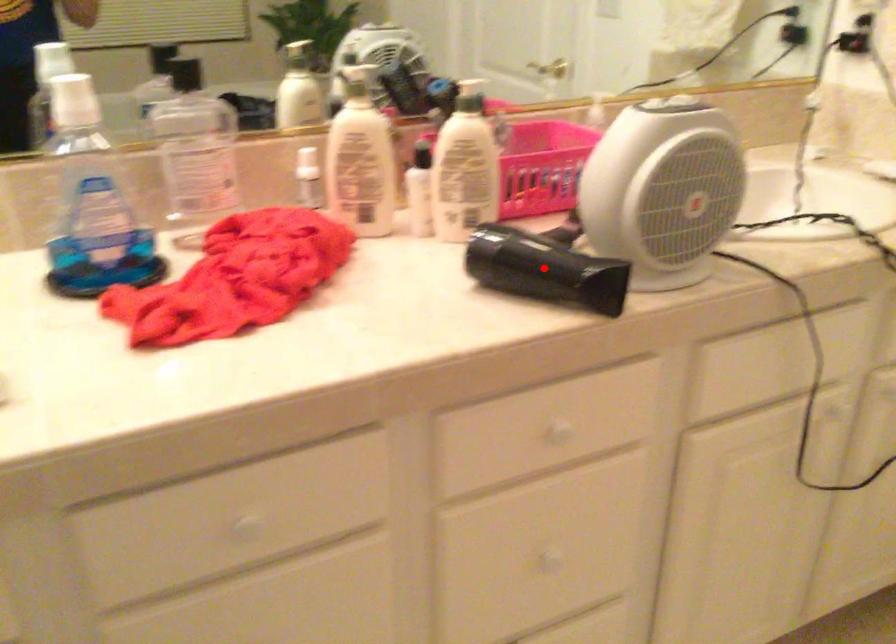
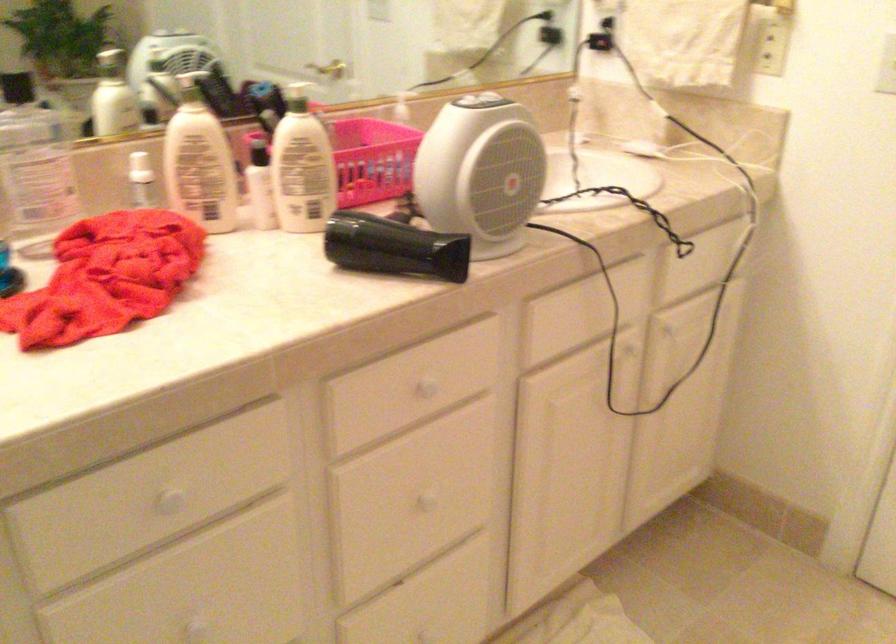
Find the pixel in the second image that matches the highlighted location in the first image.

(393, 247)